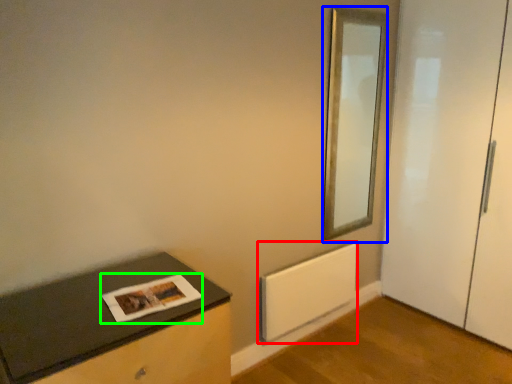
Question: Considering the real-world distances, which object is farthest from radiator (highlighted by a red box)? mirror (highlighted by a blue box) or magazine (highlighted by a green box)?

Choices:
 (A) mirror
 (B) magazine

Answer: (B)